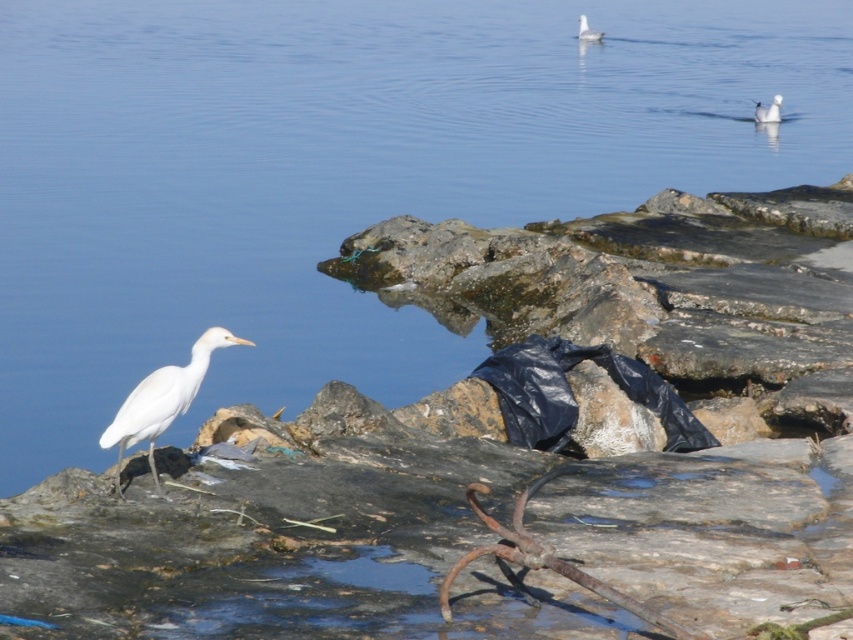
Is white matte bird at left closer to camera compared to white matte bird at upper center?

Yes, white matte bird at left is in front of white matte bird at upper center.

Which of these two, white matte bird at left or white matte bird at upper center, stands shorter?

Standing shorter between the two is white matte bird at upper center.

Which is behind, point (198, 355) or point (601, 35)?

The point (601, 35) is behind.

Identify the location of white matte bird at left. (161, 401).

Which is more to the right, white matte bird at left or white matte bird at upper right?

From the viewer's perspective, white matte bird at upper right appears more on the right side.

Does white matte bird at left appear on the left side of white matte bird at upper right?

Indeed, white matte bird at left is positioned on the left side of white matte bird at upper right.

Which is in front, point (206, 352) or point (778, 97)?

Point (206, 352) is more forward.

Locate an element on the screen. The width and height of the screenshot is (853, 640). white matte bird at left is located at coordinates (161, 401).

Does point (778, 93) come behind point (584, 22)?

No, it is not.

Does white matte bird at upper right have a larger size compared to white matte bird at upper center?

Incorrect, white matte bird at upper right is not larger than white matte bird at upper center.

Who is more forward, [759,108] or [584,38]?

Point [759,108]

Find the location of a particular element. white matte bird at upper right is located at coordinates (769, 109).